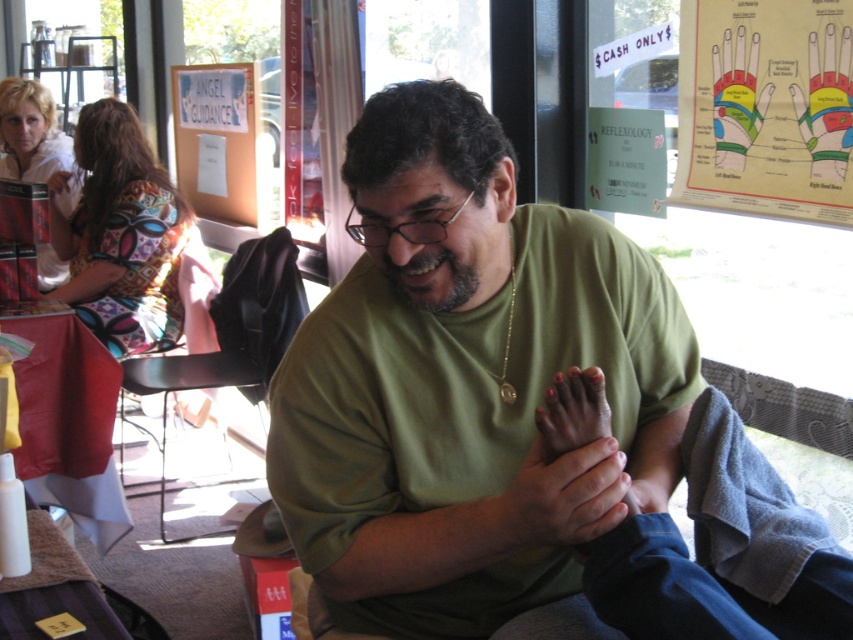
Who is lower down, green matte shirt at center or white paper at upper left?

green matte shirt at center

Is green matte shirt at center in front of white paper at upper left?

That is True.

Between point (321, 320) and point (198, 109), which one is positioned behind?

Point (198, 109)

The width and height of the screenshot is (853, 640). Identify the location of green matte shirt at center. (465, 384).

Who is more distant from viewer, (241, 188) or (582, 433)?

Positioned behind is point (241, 188).

Where is `white paper at upper left`? The width and height of the screenshot is (853, 640). white paper at upper left is located at coordinates (215, 140).

Does smooth skin hands at center have a lesser width compared to pink matte nail at center?

In fact, smooth skin hands at center might be wider than pink matte nail at center.

Can you confirm if smooth skin hands at center is smaller than pink matte nail at center?

No.

I want to click on smooth skin hands at center, so click(x=563, y=497).